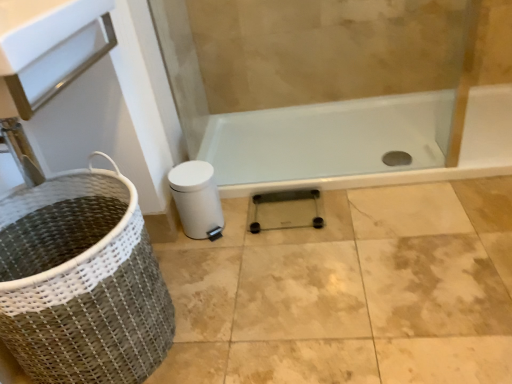
Where is `free space in front of transparent glass scale at center`? free space in front of transparent glass scale at center is located at coordinates point(298,260).